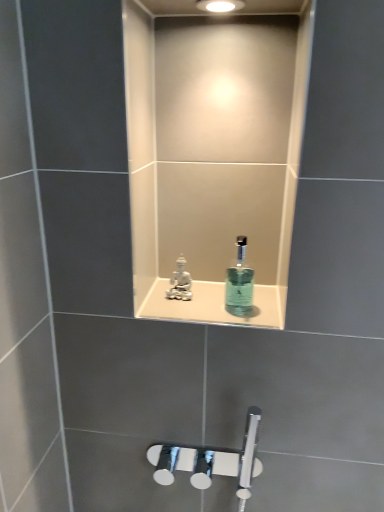
You are a GUI agent. You are given a task and a screenshot of the screen. Output one action in this format:
    pyautogui.click(x=<x>, y=<y>)
    Task: Click on the free spot above white glossy statue at center (from a real-world perspective)
    
    Given the screenshot: What is the action you would take?
    pyautogui.click(x=213, y=301)